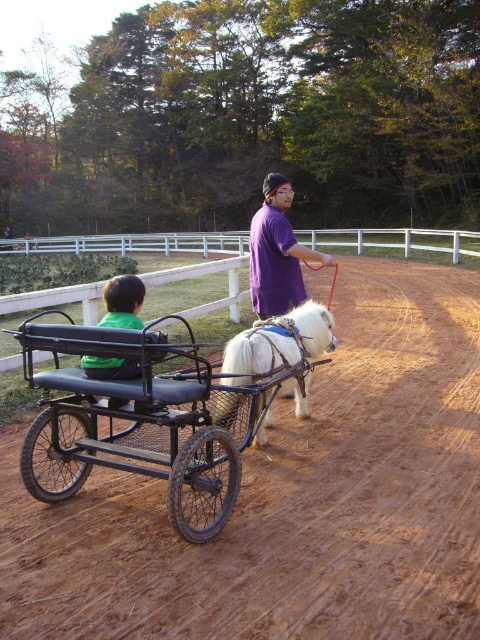
From the picture: You are a farmer standing on the edge of the brown dirt field at center and want to lead the white soft fur horse at center to a watering trough located on the other side of the field. Can you estimate if the horse will have enough space to walk through the field without getting stuck?

The brown dirt field at center might be wider than white soft fur horse at center, so there is a possibility that the horse can walk through the field without getting stuck, but there is uncertainty due to the comparative width not being definitively confirmed.

You are a photographer planning to take a picture of the brown dirt field at center and the green matte shirt at center. Based on their sizes in the scene, which object should you focus on to ensure both are clearly visible in the frame?

The brown dirt field at center has a larger width than the green matte shirt at center, so focusing on the brown dirt field at center would ensure both objects are clearly visible as it occupies more space in the scene.